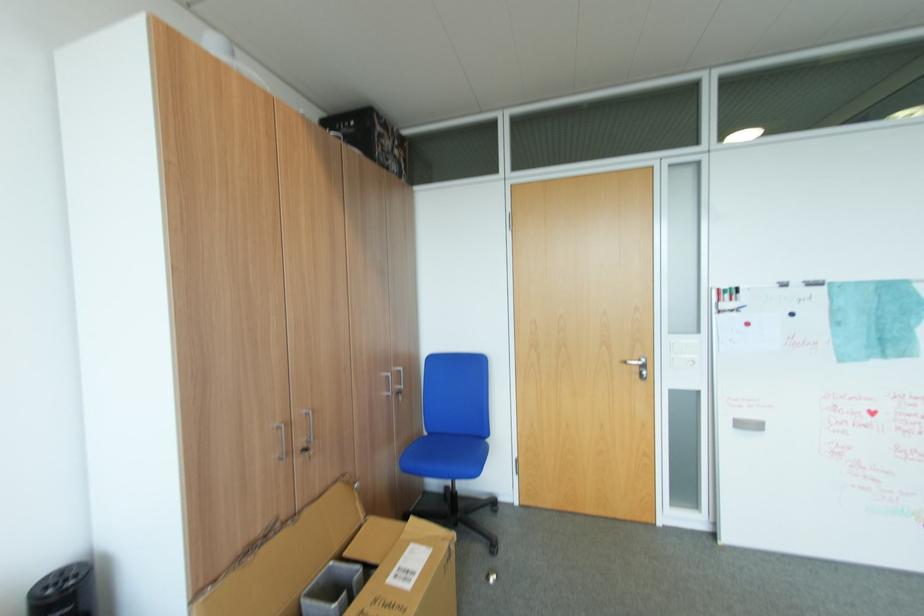
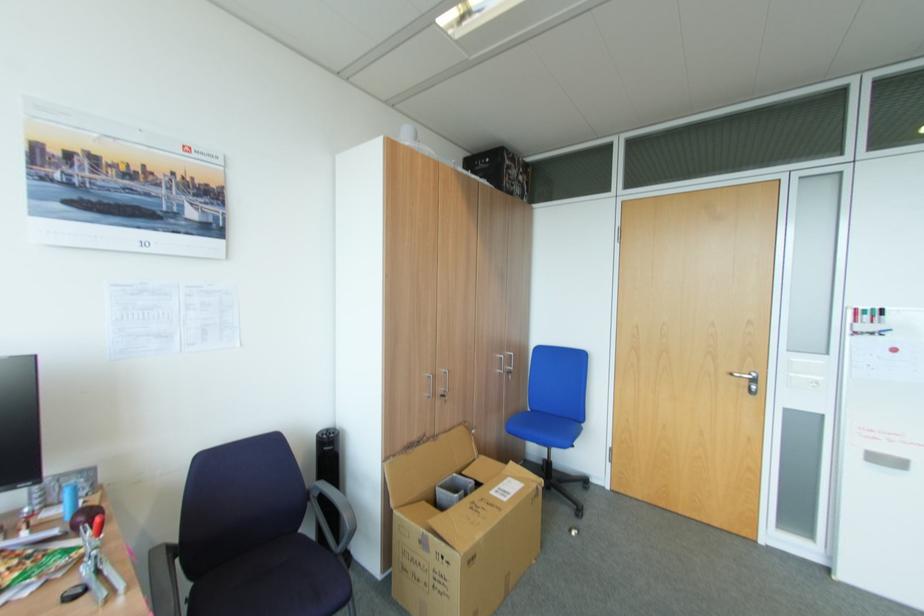
Locate, in the second image, the point that corresponds to (392,395) in the first image.

(505, 371)